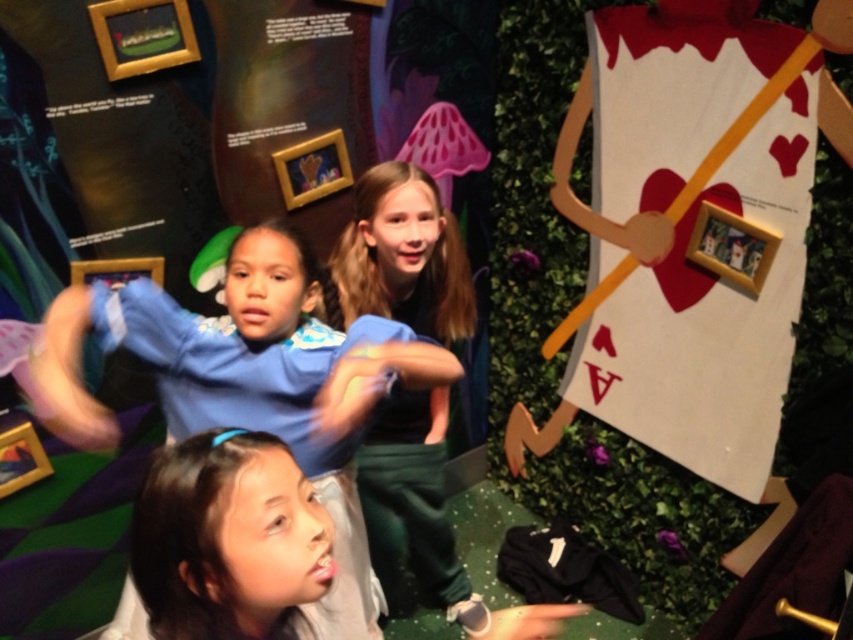
Is point (277, 163) closer to camera compared to point (138, 262)?

No.

Who is more forward, (294, 193) or (77, 269)?

Positioned in front is point (77, 269).

Image resolution: width=853 pixels, height=640 pixels. In order to click on woodenobject at upper center in this screenshot , I will do `click(312, 168)`.

Is woodenobject at upper center to the left of wooden photo frame at lower left from the viewer's perspective?

Incorrect, woodenobject at upper center is not on the left side of wooden photo frame at lower left.

Who is shorter, woodenobject at upper center or wooden photo frame at lower left?

With less height is wooden photo frame at lower left.

The image size is (853, 640). In order to click on woodenobject at upper center in this screenshot , I will do `click(312, 168)`.

Between gold wooden picture frame at upper left and woodenobject at upper center, which one appears on the left side from the viewer's perspective?

gold wooden picture frame at upper left is more to the left.

Find the location of a particular element. gold wooden picture frame at upper left is located at coordinates (142, 35).

This screenshot has height=640, width=853. Describe the element at coordinates (142, 35) in the screenshot. I see `gold wooden picture frame at upper left` at that location.

You are a GUI agent. You are given a task and a screenshot of the screen. Output one action in this format:
    pyautogui.click(x=<x>, y=<y>)
    Task: Click on the gold wooden picture frame at upper left
    The image size is (853, 640).
    Given the screenshot: What is the action you would take?
    pyautogui.click(x=142, y=35)